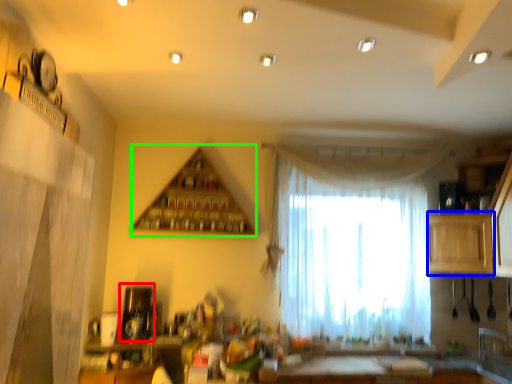
Question: Based on their relative distances, which object is farther from appliance (highlighted by a red box)? Choose from cabinetry (highlighted by a blue box) and shelf (highlighted by a green box).

Choices:
 (A) cabinetry
 (B) shelf

Answer: (A)